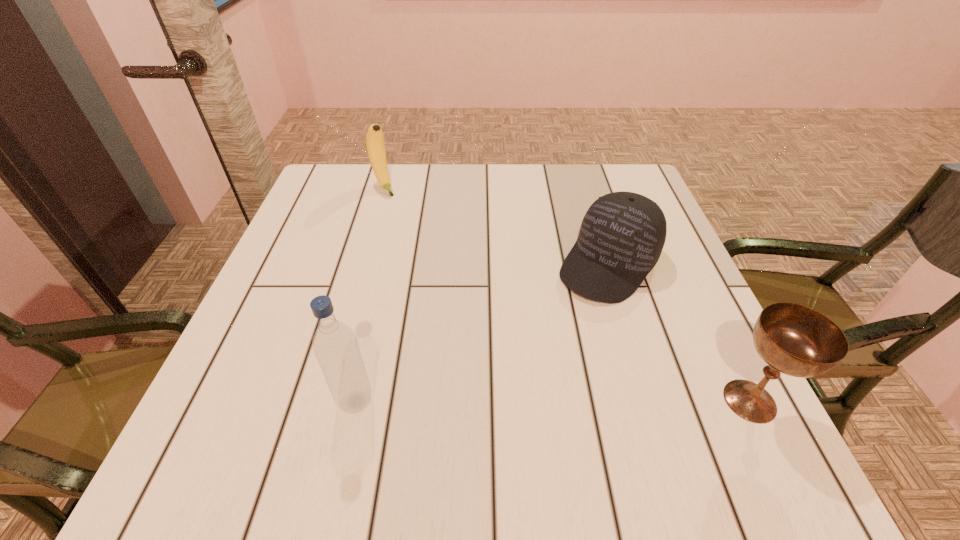
You are a GUI agent. You are given a task and a screenshot of the screen. Output one action in this format:
    pyautogui.click(x=<x>, y=<y>)
    Task: Click on the water bottle
    
    Given the screenshot: What is the action you would take?
    pyautogui.click(x=335, y=345)

I want to click on chalice, so pos(793,339).

Image resolution: width=960 pixels, height=540 pixels. What are the coordinates of `the second farthest object` in the screenshot? It's located at (622, 235).

Image resolution: width=960 pixels, height=540 pixels. Find the location of `baseball cap`. baseball cap is located at coordinates coord(622,235).

This screenshot has height=540, width=960. Find the location of `the farthest object`. the farthest object is located at coordinates (375, 145).

The image size is (960, 540). What are the coordinates of `free spot located on the back of the water bottle` in the screenshot? It's located at (387, 264).

The image size is (960, 540). I want to click on blank space located 0.250m on the left of the chalice, so click(565, 401).

You are a GUI agent. You are given a task and a screenshot of the screen. Output one action in this format:
    pyautogui.click(x=<x>, y=<y>)
    Task: Click on the vacant region located at the front of the second farthest object where the brim is located
    This screenshot has width=960, height=540.
    Given the screenshot: What is the action you would take?
    pyautogui.click(x=516, y=380)

What are the coordinates of `vacant space located at the front of the second farthest object where the brim is located` in the screenshot? It's located at (572, 310).

The image size is (960, 540). What are the coordinates of `vacant area located 0.170m at the front of the second farthest object where the brim is located` in the screenshot? It's located at (540, 350).